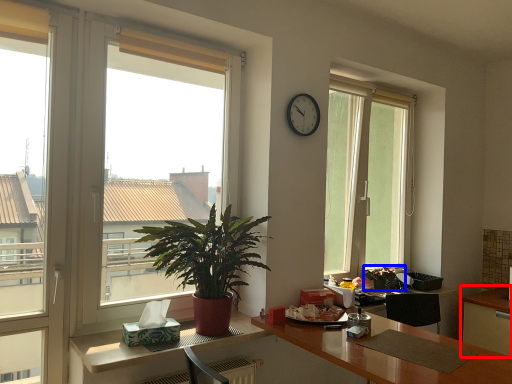
Question: Which object appears closest to the camera in this image, cabinetry (highlighted by a red box) or houseplant (highlighted by a blue box)?

Choices:
 (A) cabinetry
 (B) houseplant

Answer: (A)